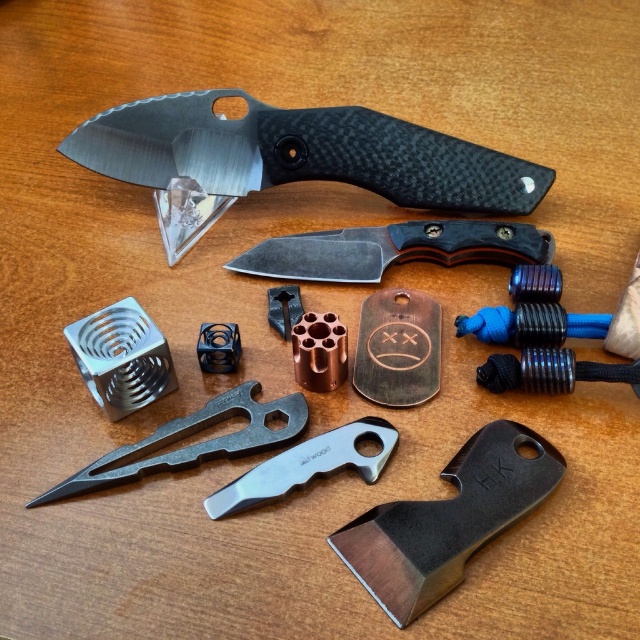
In the scene shown: You are organizing a tool display and need to place a ruler between the stainless steel hatchet at center and the dark gray metal knife at center. What is the minimum length the ruler must be to fit between them?

The minimum length the ruler must be is 18.95 inches to fit between the stainless steel hatchet at center and the dark gray metal knife at center.

You are organizing tools on a workbench and need to place a new tool between the matte black knife at upper center and the silver metallic pocket knife at center. Based on their positions, where should you place the new tool?

Since the matte black knife at upper center is located above the silver metallic pocket knife at center, you should place the new tool in between them along the vertical axis, positioning it below the matte black knife at upper center and above the silver metallic pocket knife at center.

You are a carpenter who needs to choose a tool with more space between its sides for a specific task. Which object between the stainless steel hatchet at center and the dark gray metal knife at center would you select?

The dark gray metal knife at center is thicker than the stainless steel hatchet at center, so you should choose the dark gray metal knife at center for the task requiring more space between its sides.